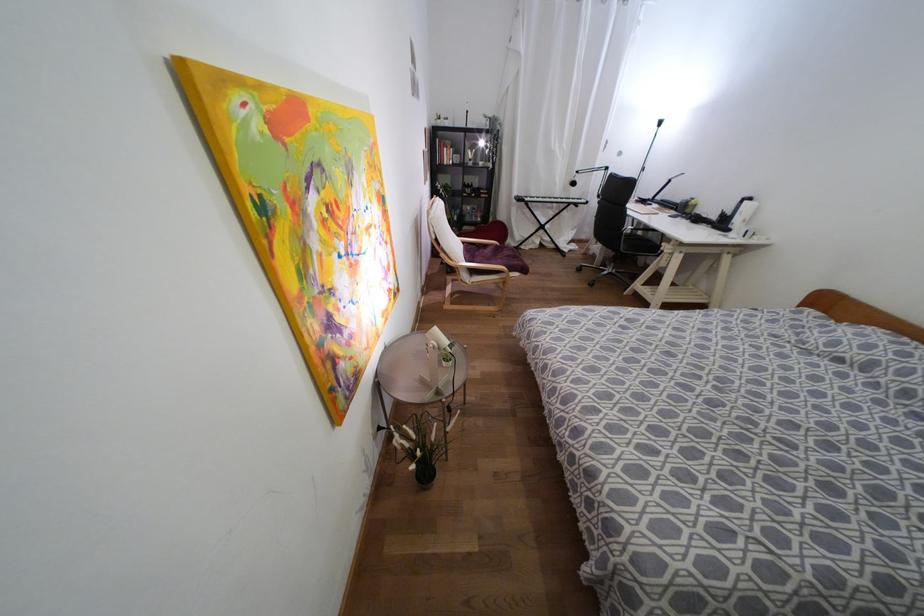
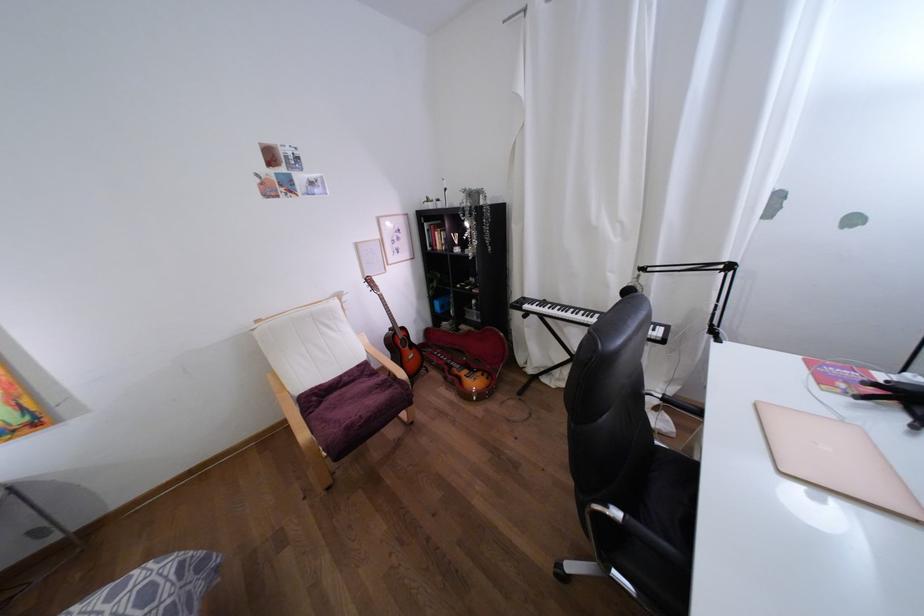
Where in the second image is the point corresponding to pixel 525 198 from the first image?

(525, 306)